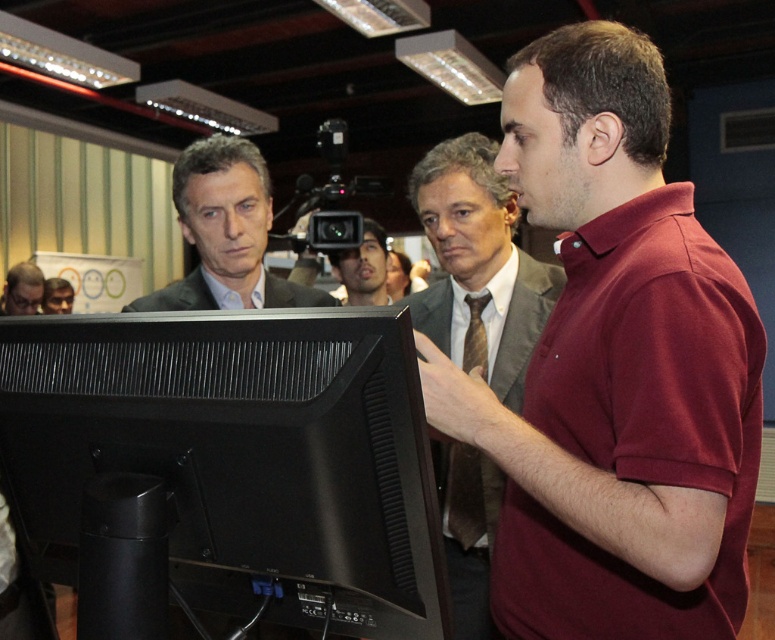
Does matte gray suit at center appear over matte black monitor at lower left?

Actually, matte gray suit at center is below matte black monitor at lower left.

Looking at this image, who is positioned more to the right, matte gray suit at center or matte black monitor at lower left?

matte gray suit at center is more to the right.

Who is more forward, (439, 323) or (43, 312)?

Point (439, 323) is more forward.

Where is `matte gray suit at center`? matte gray suit at center is located at coordinates (477, 268).

Between black matte monitor at center and matte black suit at center, which one has more height?

With more height is matte black suit at center.

Can you confirm if black matte monitor at center is positioned to the left of matte black suit at center?

In fact, black matte monitor at center is to the right of matte black suit at center.

The image size is (775, 640). Identify the location of black matte monitor at center. (232, 461).

You are a GUI agent. You are given a task and a screenshot of the screen. Output one action in this format:
    pyautogui.click(x=<x>, y=<y>)
    Task: Click on the black matte monitor at center
    
    Given the screenshot: What is the action you would take?
    pyautogui.click(x=232, y=461)

Is point (374, 342) closer to viewer compared to point (480, 568)?

Yes, it is in front of point (480, 568).

Looking at this image, does black matte monitor at center lie behind matte gray suit at center?

No, black matte monitor at center is in front of matte gray suit at center.

Is point (370, 572) farther from camera compared to point (522, 376)?

No, it is not.

Image resolution: width=775 pixels, height=640 pixels. I want to click on black matte monitor at center, so click(x=232, y=461).